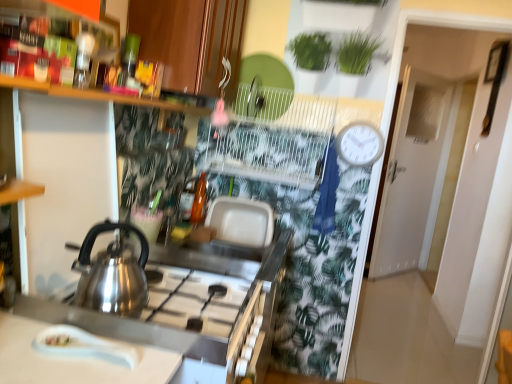
Question: Considering the relative sizes of stainless steel counter at lower left and white plastic clock at upper right in the image provided, is stainless steel counter at lower left wider than white plastic clock at upper right?

Choices:
 (A) yes
 (B) no

Answer: (A)

Question: Considering the relative sizes of stainless steel counter at lower left and white plastic clock at upper right in the image provided, is stainless steel counter at lower left bigger than white plastic clock at upper right?

Choices:
 (A) no
 (B) yes

Answer: (B)

Question: Can you confirm if stainless steel counter at lower left is thinner than white plastic clock at upper right?

Choices:
 (A) no
 (B) yes

Answer: (A)

Question: Is stainless steel counter at lower left to the right of white plastic clock at upper right from the viewer's perspective?

Choices:
 (A) yes
 (B) no

Answer: (B)

Question: Is stainless steel counter at lower left further to the viewer compared to white plastic clock at upper right?

Choices:
 (A) yes
 (B) no

Answer: (B)

Question: From the image's perspective, is wooden shelf at upper left located above or below white matte door at upper right?

Choices:
 (A) below
 (B) above

Answer: (B)

Question: Would you say wooden shelf at upper left is to the left or to the right of white matte door at upper right in the picture?

Choices:
 (A) right
 (B) left

Answer: (B)

Question: Choose the correct answer: Is wooden shelf at upper left inside white matte door at upper right or outside it?

Choices:
 (A) inside
 (B) outside

Answer: (B)

Question: In the image, is wooden shelf at upper left positioned in front of or behind white matte door at upper right?

Choices:
 (A) front
 (B) behind

Answer: (A)

Question: Does point (257, 357) appear closer or farther from the camera than point (6, 342)?

Choices:
 (A) farther
 (B) closer

Answer: (A)

Question: Is stainless steel counter at lower left in front of or behind white glossy spoon at lower left in the image?

Choices:
 (A) front
 (B) behind

Answer: (B)

Question: From their relative heights in the image, would you say stainless steel counter at lower left is taller or shorter than white glossy spoon at lower left?

Choices:
 (A) tall
 (B) short

Answer: (A)

Question: From a real-world perspective, is stainless steel counter at lower left above or below white glossy spoon at lower left?

Choices:
 (A) above
 (B) below

Answer: (B)

Question: Is point (415, 251) positioned closer to the camera than point (337, 147)?

Choices:
 (A) farther
 (B) closer

Answer: (A)

Question: From a real-world perspective, is white matte door at upper right above or below white plastic clock at upper right?

Choices:
 (A) below
 (B) above

Answer: (A)